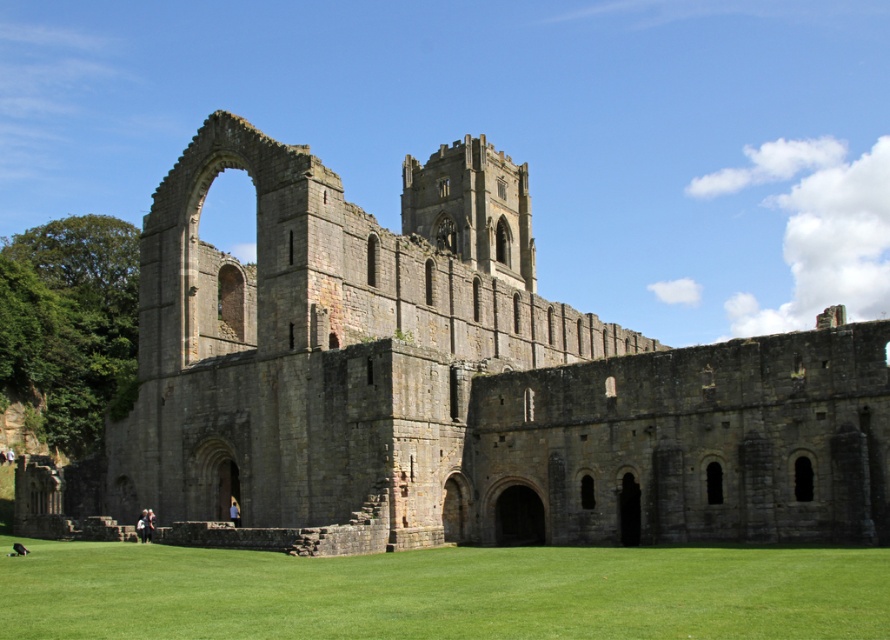
You are standing at the entrance of Fountains Abbey and want to take a photo of the gray stone monastery at center. If your camera has a maximum focus range of 150 feet, will you need to move closer to capture the monastery clearly?

The gray stone monastery at center is 151.87 feet away from the viewer. Since the camera can only focus up to 150 feet, you need to move closer to ensure the monastery is in focus.